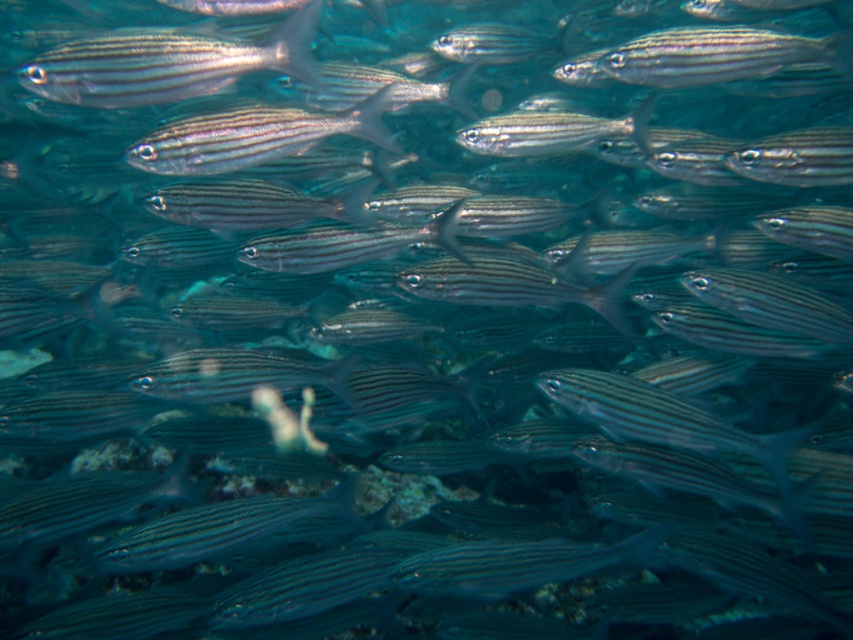
Which is in front, point (225, 80) or point (180, 125)?

Point (225, 80) is in front.

What do you see at coordinates (164, 64) in the screenshot?
I see `shiny silver fish at upper left` at bounding box center [164, 64].

The width and height of the screenshot is (853, 640). I want to click on shiny silver fish at upper left, so click(x=164, y=64).